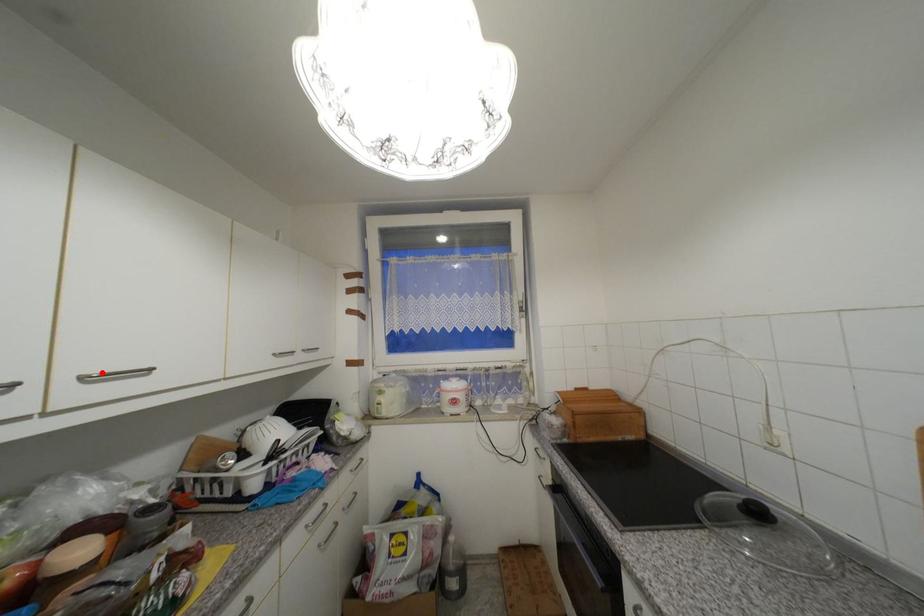
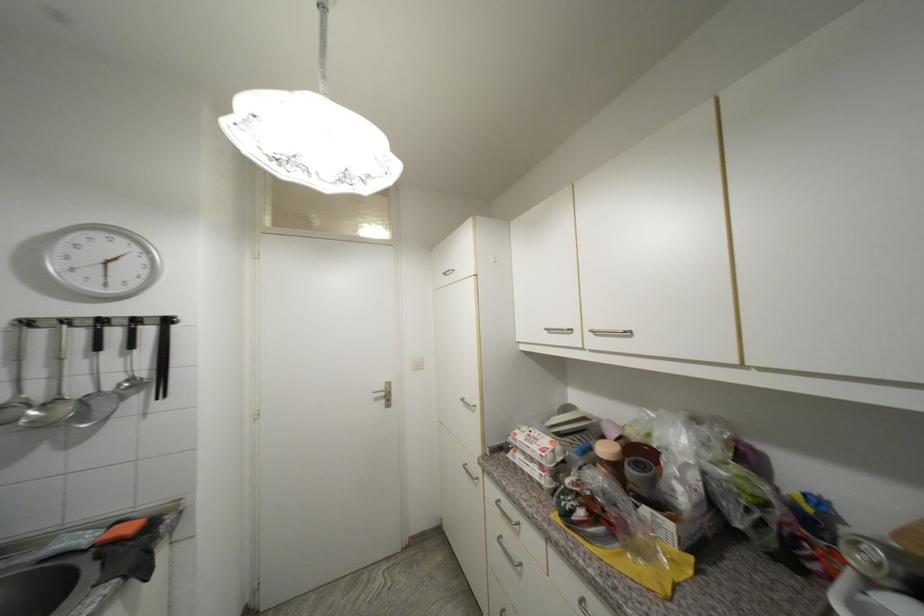
Where in the second image is the point corresponding to the highlighted location from the first image?

(601, 330)